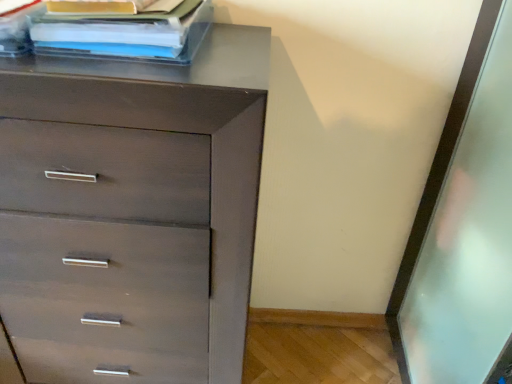
Question: Considering the positions of point (183, 380) and point (89, 26), is point (183, 380) closer or farther from the camera than point (89, 26)?

Choices:
 (A) closer
 (B) farther

Answer: (B)

Question: From the image's perspective, is matte brown chest of drawers at upper left located above or below matte plastic book at upper left?

Choices:
 (A) below
 (B) above

Answer: (A)

Question: Do you think matte brown chest of drawers at upper left is within matte plastic book at upper left, or outside of it?

Choices:
 (A) inside
 (B) outside

Answer: (B)

Question: Is matte plastic book at upper left to the left or to the right of matte brown chest of drawers at upper left in the image?

Choices:
 (A) left
 (B) right

Answer: (B)

Question: Considering their positions, is matte plastic book at upper left located in front of or behind matte brown chest of drawers at upper left?

Choices:
 (A) behind
 (B) front

Answer: (A)

Question: From a real-world perspective, is matte plastic book at upper left positioned above or below matte brown chest of drawers at upper left?

Choices:
 (A) above
 (B) below

Answer: (A)

Question: In terms of width, does matte plastic book at upper left look wider or thinner when compared to matte brown chest of drawers at upper left?

Choices:
 (A) wide
 (B) thin

Answer: (B)